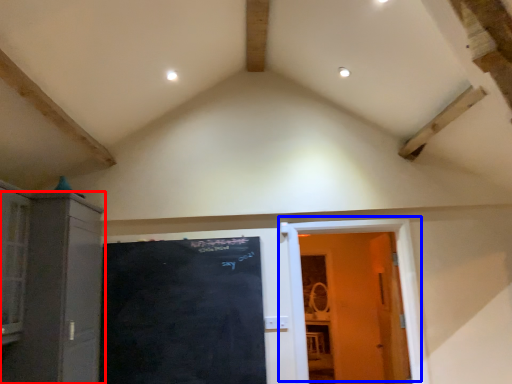
Question: Among these objects, which one is nearest to the camera, cabinetry (highlighted by a red box) or door (highlighted by a blue box)?

Choices:
 (A) cabinetry
 (B) door

Answer: (A)